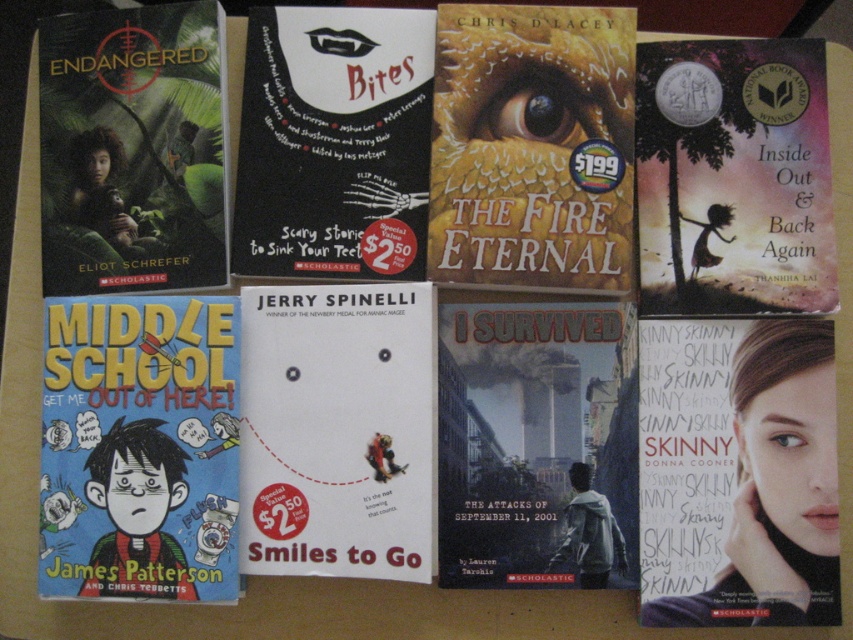
Which is above, cartoonish paper book at lower left or white paper book at center?

white paper book at center is above.

Which of these two, cartoonish paper book at lower left or white paper book at center, stands taller?

cartoonish paper book at lower left

Between point (152, 502) and point (300, 304), which one is positioned in front?

Point (152, 502)

This screenshot has height=640, width=853. What are the coordinates of `cartoonish paper book at lower left` in the screenshot? It's located at (138, 449).

Is matte pink paper at upper right shorter than black matte book cover at center?

Correct, matte pink paper at upper right is not as tall as black matte book cover at center.

Does matte pink paper at upper right appear on the right side of black matte book cover at center?

Correct, you'll find matte pink paper at upper right to the right of black matte book cover at center.

The width and height of the screenshot is (853, 640). What do you see at coordinates (733, 177) in the screenshot?
I see `matte pink paper at upper right` at bounding box center [733, 177].

Image resolution: width=853 pixels, height=640 pixels. Find the location of `matte pink paper at upper right`. matte pink paper at upper right is located at coordinates (733, 177).

Measure the distance between matte white book at bottom right and camera.

The distance of matte white book at bottom right from camera is 88.59 centimeters.

Is point (740, 387) in front of point (258, 484)?

Yes, it is.

I want to click on matte white book at bottom right, so click(738, 474).